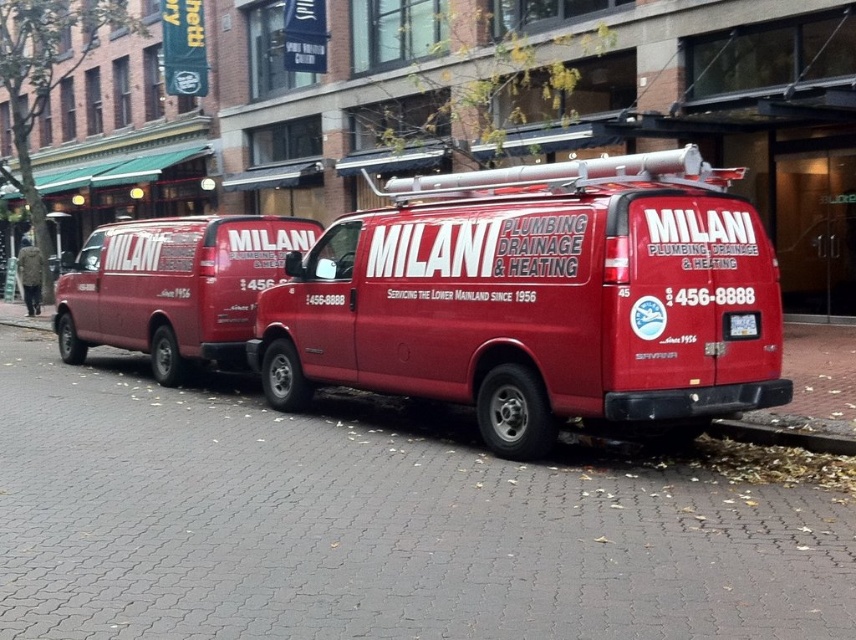
You are standing on the cobblestone street looking at the two red Milani company vans. There are two points marked on the vans. Point A is at coordinate point (194, 589) and Point B is at coordinate point (730, 435). Which point is closer to you?

Point A at coordinate point (194, 589) is closer to you than point B at coordinate point (730, 435).

You are a customer standing on the gray cobblestone pavement at center and want to get into the matte red van at left. Which direction should you walk to reach the van?

The gray cobblestone pavement at center is in front of the matte red van at left, so you should walk backward to reach the matte red van at left.